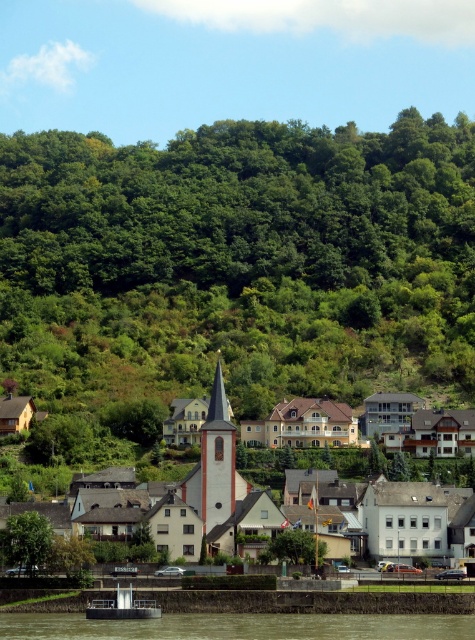
You are standing on the shore of the brown concrete river at lower center and want to see the top of the green leafy tree at center. Since the river is higher, will the tree be visible above the river?

The brown concrete river at lower center is taller than the green leafy tree at center, so the tree will not be visible above the river.

You are standing at the center of the town and want to reach the brown concrete river at lower center. According to the map coordinates, where should you head to find it?

The brown concrete river at lower center is located at point (239, 627), so you should head towards the coordinates (239, 627) to find it.